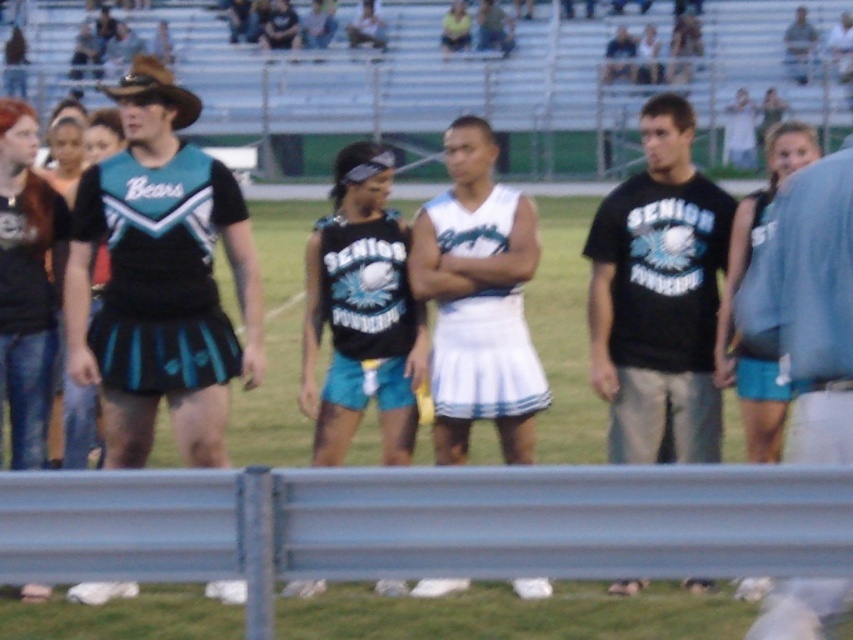
Find the location of a particular element. The height and width of the screenshot is (640, 853). blue fabric shorts at right is located at coordinates (737, 289).

Can you confirm if blue fabric shorts at right is thinner than matte black tank top at center?

Incorrect, blue fabric shorts at right's width is not less than matte black tank top at center's.

Locate an element on the screen. The height and width of the screenshot is (640, 853). blue fabric shorts at right is located at coordinates (737, 289).

Describe the element at coordinates (422, 524) in the screenshot. The width and height of the screenshot is (853, 640). I see `metallic gray rail at lower center` at that location.

This screenshot has height=640, width=853. Find the location of `metallic gray rail at lower center`. metallic gray rail at lower center is located at coordinates (422, 524).

Between point (627, 513) and point (590, 372), which one is positioned behind?

The point (590, 372) is behind.

The image size is (853, 640). Find the location of `metallic gray rail at lower center`. metallic gray rail at lower center is located at coordinates (422, 524).

Locate an element on the screen. The height and width of the screenshot is (640, 853). blue denim shorts at right is located at coordinates (807, 305).

Is blue denim shorts at right positioned behind matte black cheerleading outfit at left?

That is False.

Is point (822, 403) positioned before point (49, 448)?

That is True.

I want to click on blue denim shorts at right, so click(x=807, y=305).